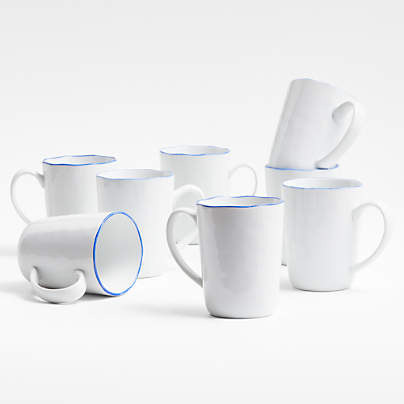
At what (x,y) coordinates should I click in order to perform the action: click on mugs. Please return your answer as a coordinate pair (x, y). Looking at the image, I should click on (248, 239), (325, 222), (312, 113), (214, 178), (270, 175), (123, 188), (51, 187), (60, 240).